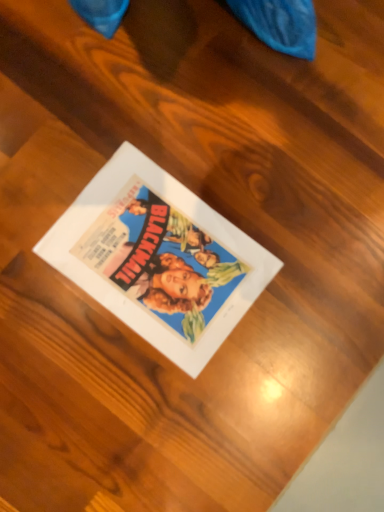
In order to click on empty space that is ontop of matte paper poster at center in this screenshot , I will do `click(159, 257)`.